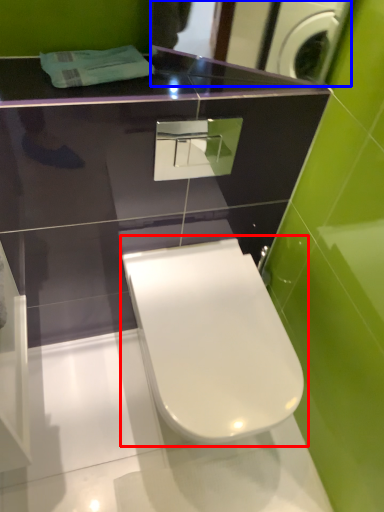
Question: Which object appears farthest to the camera in this image, toilet (highlighted by a red box) or mirror (highlighted by a blue box)?

Choices:
 (A) toilet
 (B) mirror

Answer: (A)